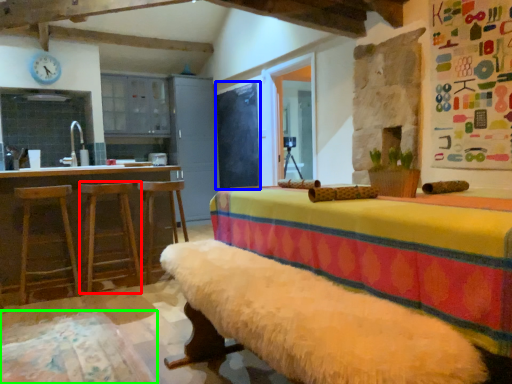
Question: Which is farther away from bar stool (highlighted by a red box)? bulletin board (highlighted by a blue box) or bedding (highlighted by a green box)?

Choices:
 (A) bulletin board
 (B) bedding

Answer: (A)